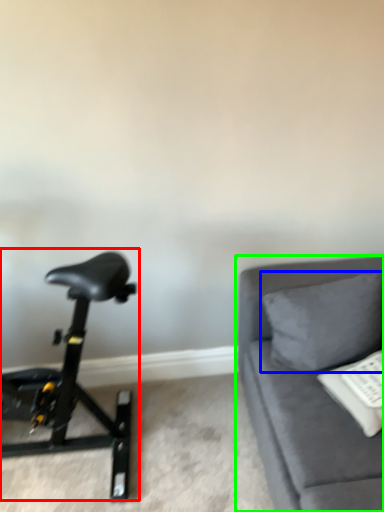
Question: Which object is positioned closest to stationary bicycle (highlighted by a red box)? Select from pillow (highlighted by a blue box) and studio couch (highlighted by a green box).

Choices:
 (A) pillow
 (B) studio couch

Answer: (B)